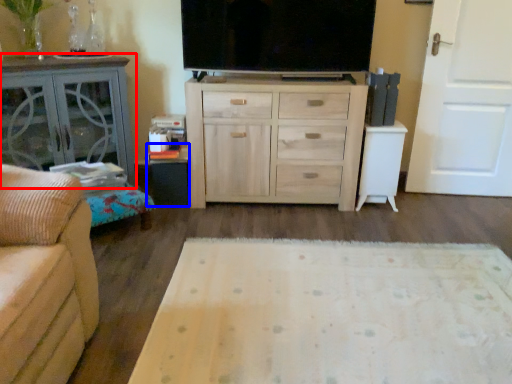
Question: Which point is further to the camera, table (highlighted by a red box) or table (highlighted by a blue box)?

Choices:
 (A) table
 (B) table

Answer: (B)